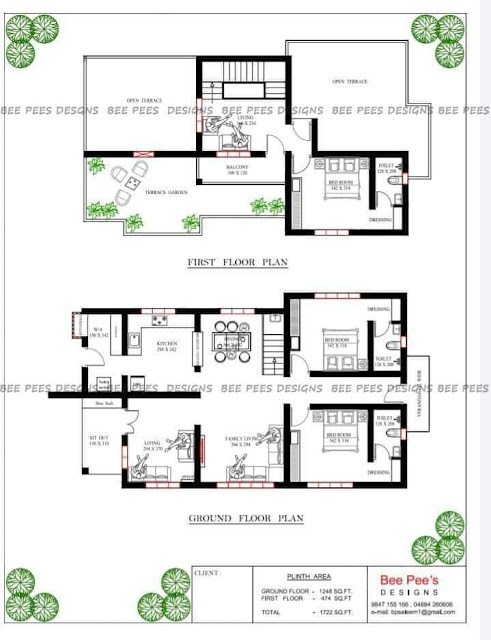
You are a GUI agent. You are given a task and a screenshot of the screen. Output one action in this format:
    pyautogui.click(x=<x>, y=<y>)
    Task: Click on the stairs
    
    Given the screenshot: What is the action you would take?
    pyautogui.click(x=245, y=70), pyautogui.click(x=279, y=348)